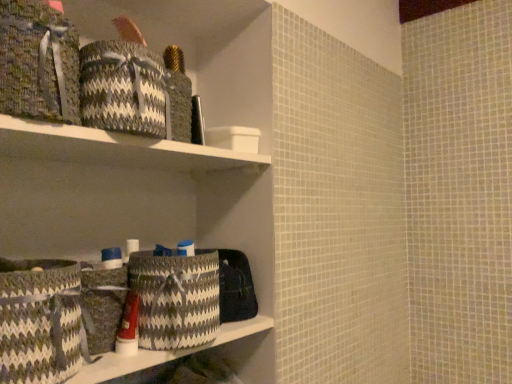
Locate an element on the screen. The height and width of the screenshot is (384, 512). white matte shelf at upper center is located at coordinates (114, 148).

What do you see at coordinates (114, 148) in the screenshot?
I see `white matte shelf at upper center` at bounding box center [114, 148].

Image resolution: width=512 pixels, height=384 pixels. What do you see at coordinates (102, 305) in the screenshot? I see `textured woven basket at lower left, the second basket in the front-to-back sequence` at bounding box center [102, 305].

What do you see at coordinates (176, 298) in the screenshot? The height and width of the screenshot is (384, 512). I see `textured woven laundry basket at center` at bounding box center [176, 298].

Describe the element at coordinates (164, 353) in the screenshot. I see `textured woven basket at lower left` at that location.

At what (x,y) coordinates should I click in order to perform the action: click on textured woven basket at lower left, placed as the 2th basket when sorted from back to front. Please return your answer as a coordinate pair (x, y). Looking at the image, I should click on (40, 322).

From the image's perspective, is textured woven basket at lower left, positioned as the 1th basket in back-to-front order, located beneath woven fabric basket at upper left, acting as the 2th material starting from the right?

Yes, from the image's perspective, textured woven basket at lower left, positioned as the 1th basket in back-to-front order, is beneath woven fabric basket at upper left, acting as the 2th material starting from the right.

Is textured woven basket at lower left, positioned as the 1th basket in back-to-front order, aimed at woven fabric basket at upper left, acting as the 2th material starting from the right?

No, textured woven basket at lower left, positioned as the 1th basket in back-to-front order, is not turned towards woven fabric basket at upper left, acting as the 2th material starting from the right.

Is textured woven basket at lower left, the second basket in the front-to-back sequence, inside or outside of woven fabric basket at upper left, acting as the 2th material starting from the right?

textured woven basket at lower left, the second basket in the front-to-back sequence, is spatially situated outside woven fabric basket at upper left, acting as the 2th material starting from the right.

Looking at this image, in the image, is textured woven basket at lower left positioned in front of or behind matte plastic tube at center?

Clearly, textured woven basket at lower left is in front of matte plastic tube at center.

Is point (139, 370) positioned before point (129, 342)?

Yes.

Does textured woven basket at lower left appear on the left side of matte plastic tube at center?

No, textured woven basket at lower left is not to the left of matte plastic tube at center.

Identify the location of ledge located underneath the matte plastic tube at center (from a real-world perspective). The height and width of the screenshot is (384, 512). point(164,353).

Considering the relative positions of textured woven laundry basket at center and matte plastic tube at center in the image provided, is textured woven laundry basket at center to the left or to the right of matte plastic tube at center?

textured woven laundry basket at center is positioned on matte plastic tube at center's right side.

Considering the sizes of objects textured woven laundry basket at center and matte plastic tube at center in the image provided, who is shorter, textured woven laundry basket at center or matte plastic tube at center?

Standing shorter between the two is matte plastic tube at center.

Would you say textured woven basket at lower left is outside black and white woven basket at upper left, which ranks as the first material in right-to-left order?

textured woven basket at lower left is positioned outside black and white woven basket at upper left, which ranks as the first material in right-to-left order.

From the picture: Considering the sizes of objects textured woven basket at lower left and black and white woven basket at upper left, marked as the second material in a left-to-right arrangement, in the image provided, who is smaller, textured woven basket at lower left or black and white woven basket at upper left, marked as the second material in a left-to-right arrangement,?

Smaller between the two is textured woven basket at lower left.

Is textured woven basket at lower left at the left side of black and white woven basket at upper left, which ranks as the first material in right-to-left order?

In fact, textured woven basket at lower left is to the right of black and white woven basket at upper left, which ranks as the first material in right-to-left order.

Is white matte shelf at upper center at the back of woven fabric basket at upper left, acting as the 2th material starting from the right?

No, woven fabric basket at upper left, acting as the 2th material starting from the right, is not facing away from white matte shelf at upper center.

From a real-world perspective, between woven fabric basket at upper left, acting as the 2th material starting from the right, and white matte shelf at upper center, who is vertically higher?

woven fabric basket at upper left, acting as the 2th material starting from the right, from a real-world perspective.

Between woven fabric basket at upper left, which appears as the first material when viewed from the left, and white matte shelf at upper center, which one has larger size?

Bigger between the two is woven fabric basket at upper left, which appears as the first material when viewed from the left.

Is point (68, 93) closer or farther from the camera than point (194, 147)?

Clearly, point (68, 93) is closer to the camera than point (194, 147).

Are textured woven basket at lower left, placed as the 2th basket when sorted from back to front, and textured woven basket at lower left located far from each other?

No, there isn't a large distance between textured woven basket at lower left, placed as the 2th basket when sorted from back to front, and textured woven basket at lower left.

Based on the photo, from the image's perspective, is textured woven basket at lower left, the first basket positioned from the front, below textured woven basket at lower left?

Actually, textured woven basket at lower left, the first basket positioned from the front, appears above textured woven basket at lower left in the image.

Does point (12, 371) come closer to viewer compared to point (152, 356)?

Yes.

How different are the orientations of textured woven basket at lower left, the first basket positioned from the front, and textured woven basket at lower left in degrees?

The facing directions of textured woven basket at lower left, the first basket positioned from the front, and textured woven basket at lower left are 0.791 degrees apart.

From the image's perspective, which is below, textured woven laundry basket at center or black and white woven basket at upper left, which ranks as the first material in right-to-left order?

textured woven laundry basket at center.

From the picture: Who is shorter, textured woven laundry basket at center or black and white woven basket at upper left, marked as the second material in a left-to-right arrangement?

black and white woven basket at upper left, marked as the second material in a left-to-right arrangement.

From a real-world perspective, who is located higher, textured woven laundry basket at center or black and white woven basket at upper left, marked as the second material in a left-to-right arrangement?

In real-world perspective, black and white woven basket at upper left, marked as the second material in a left-to-right arrangement, is above.

Image resolution: width=512 pixels, height=384 pixels. There is a textured woven basket at lower left, positioned as the 1th basket in back-to-front order. What are the coordinates of `the 2nd material above it (from a real-world perspective)` in the screenshot? It's located at click(x=38, y=62).

The image size is (512, 384). I want to click on toiletry lying above the textured woven basket at lower left (from the image's perspective), so click(x=128, y=327).

Based on their spatial positions, is woven fabric basket at upper left, which appears as the first material when viewed from the left, or black and white woven basket at upper left, marked as the second material in a left-to-right arrangement, closer to matte plastic tube at center?

Based on the image, black and white woven basket at upper left, marked as the second material in a left-to-right arrangement, appears to be nearer to matte plastic tube at center.

Which object lies further to the anchor point woven fabric basket at upper left, which appears as the first material when viewed from the left, textured woven basket at lower left, the second basket in the front-to-back sequence, or textured woven basket at lower left, the first basket positioned from the front?

Among the two, textured woven basket at lower left, the second basket in the front-to-back sequence, is located further to woven fabric basket at upper left, which appears as the first material when viewed from the left.

When comparing their distances from white matte shelf at upper center, does textured woven basket at lower left or black and white woven basket at upper left, marked as the second material in a left-to-right arrangement, seem closer?

black and white woven basket at upper left, marked as the second material in a left-to-right arrangement, is closer to white matte shelf at upper center.

Estimate the real-world distances between objects in this image. Which object is closer to woven fabric basket at upper left, which appears as the first material when viewed from the left, textured woven basket at lower left or textured woven basket at lower left, the first basket positioned from the front?

textured woven basket at lower left, the first basket positioned from the front, is positioned closer to the anchor woven fabric basket at upper left, which appears as the first material when viewed from the left.

Which object lies nearer to the anchor point black and white woven basket at upper left, marked as the second material in a left-to-right arrangement, white matte shelf at upper center or textured woven basket at lower left, positioned as the 1th basket in back-to-front order?

white matte shelf at upper center is positioned closer to the anchor black and white woven basket at upper left, marked as the second material in a left-to-right arrangement.

From the image, which object appears to be nearer to woven fabric basket at upper left, acting as the 2th material starting from the right, matte plastic tube at center or textured woven basket at lower left, the first basket positioned from the front?

textured woven basket at lower left, the first basket positioned from the front.

From the image, which object appears to be farther from black and white woven basket at upper left, marked as the second material in a left-to-right arrangement, textured woven basket at lower left or textured woven basket at lower left, the first basket positioned from the front?

textured woven basket at lower left lies further to black and white woven basket at upper left, marked as the second material in a left-to-right arrangement, than the other object.

From the image, which object appears to be nearer to textured woven basket at lower left, placed as the 2th basket when sorted from back to front, textured woven basket at lower left or textured woven basket at lower left, the second basket in the front-to-back sequence?

Among the two, textured woven basket at lower left, the second basket in the front-to-back sequence, is located nearer to textured woven basket at lower left, placed as the 2th basket when sorted from back to front.

Find the location of `cabinet between black and white woven basket at upper left, marked as the second material in a left-to-right arrangement, and textured woven basket at lower left, the second basket in the front-to-back sequence, from top to bottom`. cabinet between black and white woven basket at upper left, marked as the second material in a left-to-right arrangement, and textured woven basket at lower left, the second basket in the front-to-back sequence, from top to bottom is located at coordinates (114, 148).

At what (x,y) coordinates should I click in order to perform the action: click on basket between black and white woven basket at upper left, which ranks as the first material in right-to-left order, and textured woven basket at lower left, the second basket in the front-to-back sequence, in the up-down direction. Please return your answer as a coordinate pair (x, y). Image resolution: width=512 pixels, height=384 pixels. Looking at the image, I should click on (40, 322).

The image size is (512, 384). What are the coordinates of `cabinet between black and white woven basket at upper left, marked as the second material in a left-to-right arrangement, and textured woven laundry basket at center in the up-down direction` in the screenshot? It's located at (114, 148).

The width and height of the screenshot is (512, 384). Find the location of `cabinet between black and white woven basket at upper left, marked as the second material in a left-to-right arrangement, and textured woven basket at lower left, placed as the 2th basket when sorted from back to front, in the vertical direction`. cabinet between black and white woven basket at upper left, marked as the second material in a left-to-right arrangement, and textured woven basket at lower left, placed as the 2th basket when sorted from back to front, in the vertical direction is located at coordinates (114, 148).